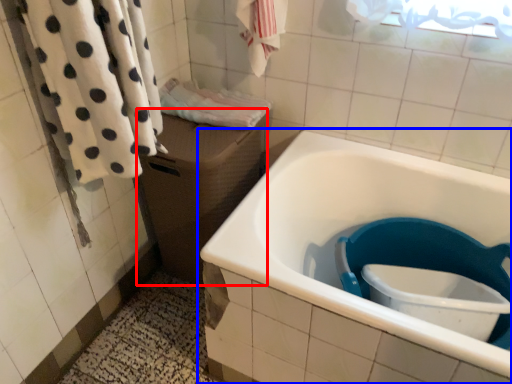
Question: Which object appears closest to the camera in this image, box (highlighted by a red box) or bathtub (highlighted by a blue box)?

Choices:
 (A) box
 (B) bathtub

Answer: (B)